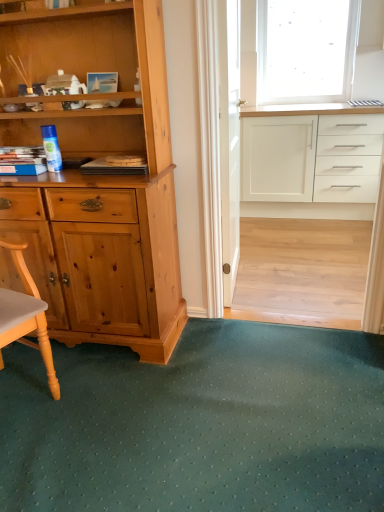
Question: Considering the positions of transparent frosted glass at upper right and green textured mat at lower center in the image, is transparent frosted glass at upper right taller or shorter than green textured mat at lower center?

Choices:
 (A) short
 (B) tall

Answer: (B)

Question: Is transparent frosted glass at upper right wider or thinner than green textured mat at lower center?

Choices:
 (A) wide
 (B) thin

Answer: (B)

Question: Estimate the real-world distances between objects in this image. Which object is closer to the white glossy cabinet at upper right?

Choices:
 (A) transparent frosted glass at upper right
 (B) clear glass screen door at center
 (C) green textured mat at lower center

Answer: (A)

Question: Which is farther from the green textured mat at lower center?

Choices:
 (A) transparent frosted glass at upper right
 (B) clear glass screen door at center
 (C) white glossy cabinet at upper right

Answer: (A)